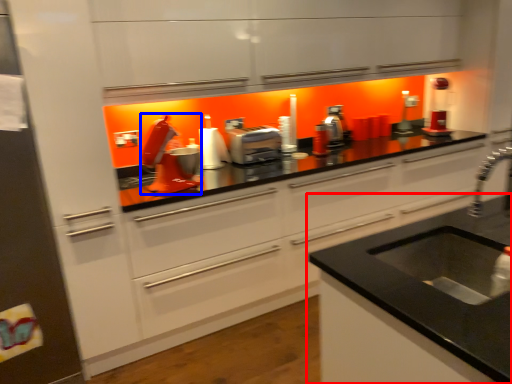
Question: Among these objects, which one is farthest to the camera, countertop (highlighted by a red box) or appliance (highlighted by a blue box)?

Choices:
 (A) countertop
 (B) appliance

Answer: (B)